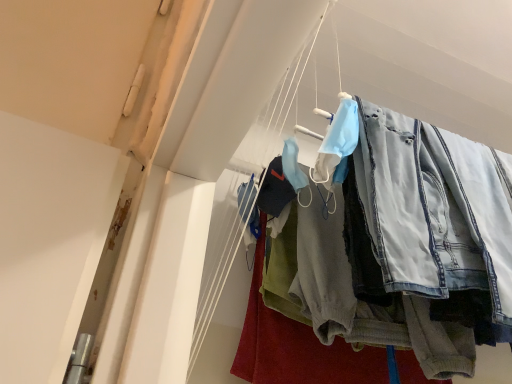
Question: Considering the relative positions of denim jeans at upper right and denim pants at center in the image provided, is denim jeans at upper right to the left or to the right of denim pants at center?

Choices:
 (A) left
 (B) right

Answer: (B)

Question: From a real-world perspective, is denim jeans at upper right above or below denim pants at center?

Choices:
 (A) below
 (B) above

Answer: (B)

Question: Considering their positions, is denim jeans at upper right located in front of or behind denim pants at center?

Choices:
 (A) behind
 (B) front

Answer: (B)

Question: Considering their positions, is denim pants at center located in front of or behind denim jeans at upper right?

Choices:
 (A) front
 (B) behind

Answer: (B)

Question: Visually, is denim pants at center positioned to the left or to the right of denim jeans at upper right?

Choices:
 (A) left
 (B) right

Answer: (A)

Question: Is denim pants at center situated inside denim jeans at upper right or outside?

Choices:
 (A) inside
 (B) outside

Answer: (B)

Question: From a real-world perspective, is denim pants at center physically located above or below denim jeans at upper right?

Choices:
 (A) above
 (B) below

Answer: (B)